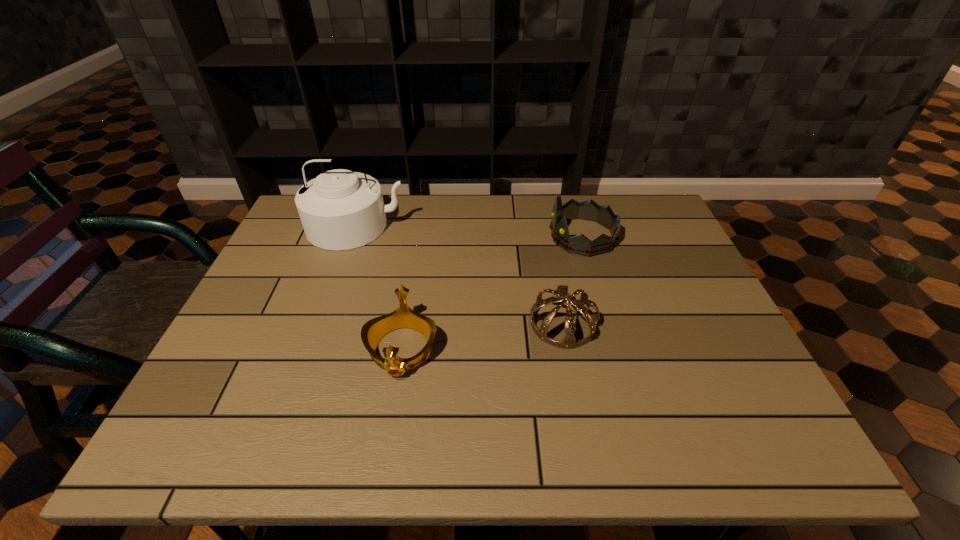
Find the location of `vacant region between the kettle and the leftmost tiara`. vacant region between the kettle and the leftmost tiara is located at coordinates (379, 288).

Where is `unoccupied position between the leftmost tiara and the second tallest object`? unoccupied position between the leftmost tiara and the second tallest object is located at coordinates (492, 293).

Locate an element on the screen. This screenshot has width=960, height=540. the closest object to the tallest tiara is located at coordinates (561, 295).

Where is `object that stands as the closest to the farthest tiara`? This screenshot has height=540, width=960. object that stands as the closest to the farthest tiara is located at coordinates (561, 295).

Locate which tiara is the second closest to the tallest object. Please provide its 2D coordinates. Your answer should be formatted as a tuple, i.e. [(x, y)], where the tuple contains the x and y coordinates of a point satisfying the conditions above.

[(561, 295)]

Locate an element on the screen. This screenshot has height=540, width=960. tiara identified as the second closest to the third shortest object is located at coordinates (372, 331).

In order to click on vacant space that satisfies the following two spatial constraints: 1. at the front of the second tallest object with jewels; 2. at the front emblem of the leftmost tiara in this screenshot , I will do `click(614, 349)`.